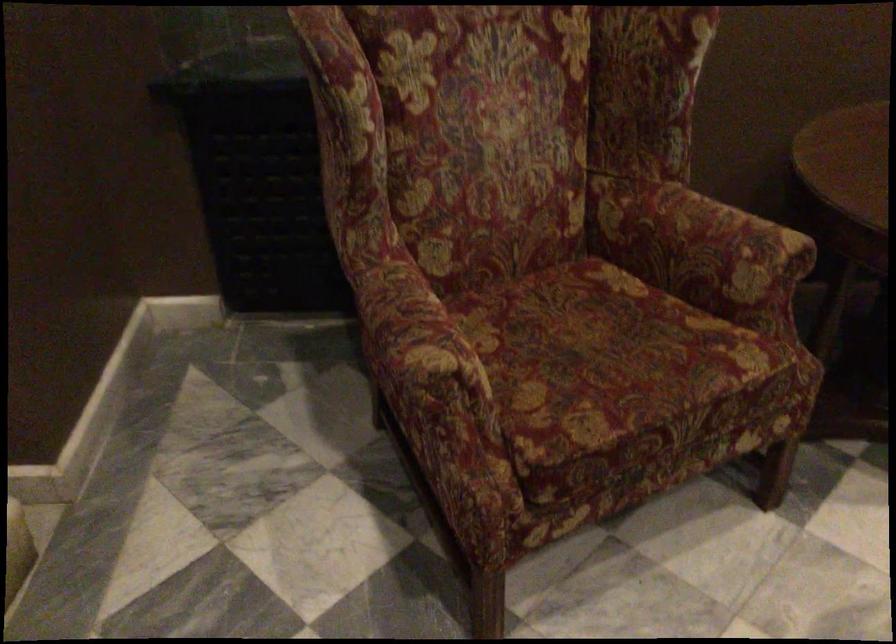
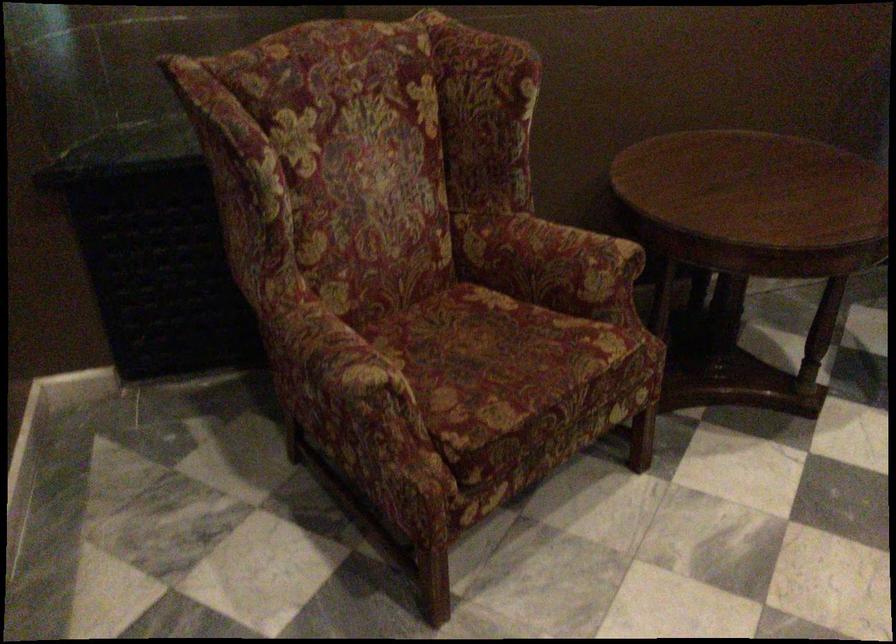
Find the pixel in the second image that matches (403,373) in the first image.

(343, 389)